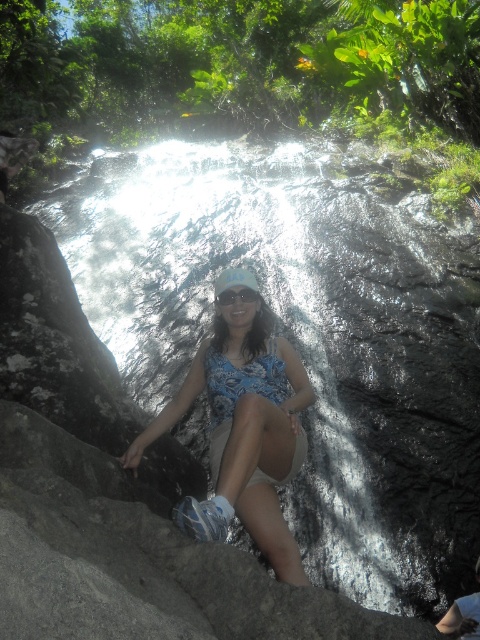
How far apart are clear water at center and blue floral dress at center?

clear water at center is 8.79 feet away from blue floral dress at center.

Which of these two, clear water at center or blue floral dress at center, stands shorter?

With less height is blue floral dress at center.

Between point (176, 244) and point (201, 500), which one is positioned in front?

Point (201, 500) is more forward.

This screenshot has width=480, height=640. Find the location of `clear water at center`. clear water at center is located at coordinates (308, 333).

Does point (171, 424) come behind point (238, 289)?

No, it is in front of (238, 289).

Between blue floral dress at center and transparent plastic goggles at center, which one is positioned higher?

transparent plastic goggles at center

You are a GUI agent. You are given a task and a screenshot of the screen. Output one action in this format:
    pyautogui.click(x=<x>, y=<y>)
    Task: Click on the blue floral dress at center
    This screenshot has height=640, width=480.
    Given the screenshot: What is the action you would take?
    pyautogui.click(x=244, y=429)

Between clear water at center and transparent plastic goggles at center, which one is positioned higher?

Positioned higher is clear water at center.

Who is lower down, clear water at center or transparent plastic goggles at center?

transparent plastic goggles at center is below.

What do you see at coordinates (308, 333) in the screenshot? The height and width of the screenshot is (640, 480). I see `clear water at center` at bounding box center [308, 333].

You are a GUI agent. You are given a task and a screenshot of the screen. Output one action in this format:
    pyautogui.click(x=<x>, y=<y>)
    Task: Click on the clear water at center
    Image resolution: width=480 pixels, height=640 pixels.
    Given the screenshot: What is the action you would take?
    pyautogui.click(x=308, y=333)